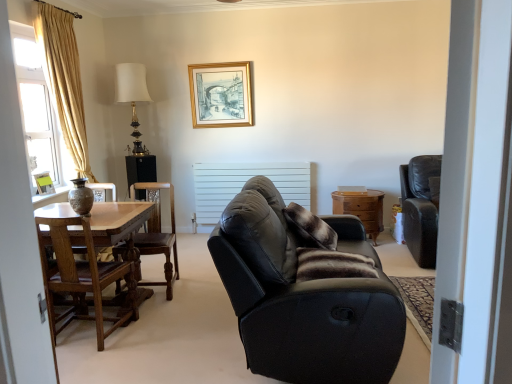
Question: Is brown fur pillow at center, the first pillow viewed from the front, not within black leather couch at center?

Choices:
 (A) yes
 (B) no

Answer: (B)

Question: Does brown fur pillow at center, marked as the second pillow in a back-to-front arrangement, have a greater height compared to black leather couch at center?

Choices:
 (A) yes
 (B) no

Answer: (B)

Question: Can you confirm if brown fur pillow at center, marked as the second pillow in a back-to-front arrangement, is positioned to the right of black leather couch at center?

Choices:
 (A) yes
 (B) no

Answer: (A)

Question: From the image's perspective, would you say brown fur pillow at center, the first pillow viewed from the front, is positioned over black leather couch at center?

Choices:
 (A) no
 (B) yes

Answer: (A)

Question: Does brown fur pillow at center, the first pillow viewed from the front, lie behind black leather couch at center?

Choices:
 (A) no
 (B) yes

Answer: (B)

Question: From a real-world perspective, is brown fur pillow at center, the first pillow viewed from the front, under black leather couch at center?

Choices:
 (A) no
 (B) yes

Answer: (A)

Question: Is white fabric lampshade at upper center positioned in front of wooden polished chair at center left, marked as the second chair in a back-to-front arrangement?

Choices:
 (A) no
 (B) yes

Answer: (A)

Question: Does white fabric lampshade at upper center have a lesser width compared to wooden polished chair at center left, the 2th chair viewed from the left?

Choices:
 (A) no
 (B) yes

Answer: (B)

Question: Is white fabric lampshade at upper center taller than wooden polished chair at center left, the 2th chair viewed from the left?

Choices:
 (A) no
 (B) yes

Answer: (B)

Question: Does white fabric lampshade at upper center have a lesser height compared to wooden polished chair at center left, positioned as the 2th chair in right-to-left order?

Choices:
 (A) no
 (B) yes

Answer: (A)

Question: Does white fabric lampshade at upper center have a greater width compared to wooden polished chair at center left, positioned as the 2th chair in right-to-left order?

Choices:
 (A) no
 (B) yes

Answer: (A)

Question: From the image's perspective, is white fabric lampshade at upper center under wooden polished chair at center left, positioned as the 2th chair in right-to-left order?

Choices:
 (A) no
 (B) yes

Answer: (A)

Question: From the image's perspective, is translucent glass window at left located above black leather couch at center?

Choices:
 (A) no
 (B) yes

Answer: (B)